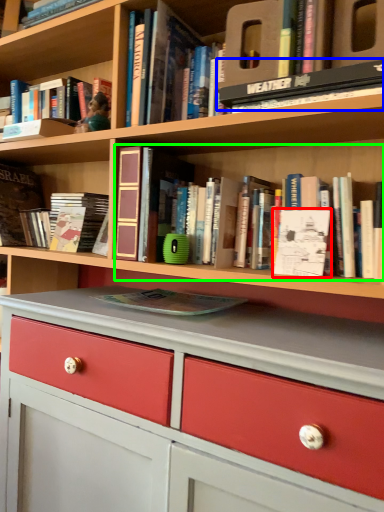
Question: Which is farther away from paperback book (highlighted by a red box)? book (highlighted by a blue box) or book (highlighted by a green box)?

Choices:
 (A) book
 (B) book

Answer: (A)